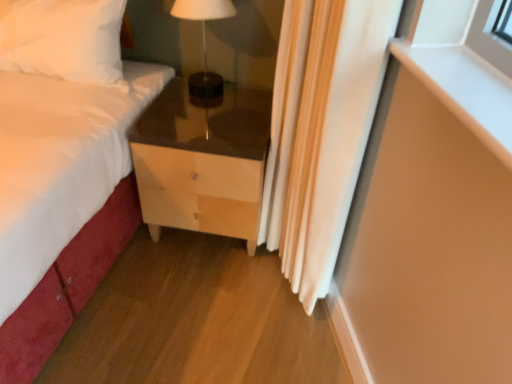
Question: Is matte wood chest of drawers at lower center taller or shorter than matte brown table lamp at center?

Choices:
 (A) short
 (B) tall

Answer: (B)

Question: In the image, is matte wood chest of drawers at lower center positioned in front of or behind matte brown table lamp at center?

Choices:
 (A) behind
 (B) front

Answer: (B)

Question: Which object is the closest to the matte brown table lamp at center?

Choices:
 (A) white fabric curtain at right
 (B) matte wood chest of drawers at lower center

Answer: (B)

Question: Based on their relative distances, which object is farther from the matte wood chest of drawers at lower center?

Choices:
 (A) white fabric curtain at right
 (B) matte brown table lamp at center

Answer: (B)